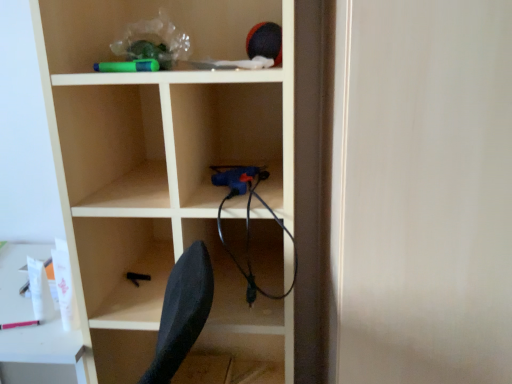
This screenshot has width=512, height=384. I want to click on white glossy table at lower left, so (x=42, y=354).

Describe the element at coordinates (42, 354) in the screenshot. The height and width of the screenshot is (384, 512). I see `white glossy table at lower left` at that location.

The image size is (512, 384). What are the coordinates of `wooden shelf at center` in the screenshot? It's located at (162, 168).

What is the approximate width of wooden shelf at center?

41.11 centimeters.

Describe the element at coordinates (162, 168) in the screenshot. Image resolution: width=512 pixels, height=384 pixels. I see `wooden shelf at center` at that location.

The width and height of the screenshot is (512, 384). In order to click on white glossy table at lower left in this screenshot , I will do `click(42, 354)`.

Which object is positioned more to the right, wooden shelf at center or white glossy table at lower left?

Positioned to the right is wooden shelf at center.

Which object is further away from the camera, wooden shelf at center or white glossy table at lower left?

Positioned behind is white glossy table at lower left.

Considering the positions of points (216, 142) and (58, 361), is point (216, 142) farther from camera compared to point (58, 361)?

Yes, point (216, 142) is farther from viewer.

From the image's perspective, is wooden shelf at center on top of white glossy table at lower left?

Yes, from the image's perspective, wooden shelf at center is over white glossy table at lower left.

From a real-world perspective, which object stands above the other?

From a 3D spatial view, wooden shelf at center is above.

Considering the sizes of objects wooden shelf at center and white glossy table at lower left in the image provided, who is thinner, wooden shelf at center or white glossy table at lower left?

wooden shelf at center is thinner.

Is wooden shelf at center taller or shorter than white glossy table at lower left?

wooden shelf at center is taller than white glossy table at lower left.

Based on the photo, considering the relative sizes of wooden shelf at center and white glossy table at lower left in the image provided, is wooden shelf at center smaller than white glossy table at lower left?

Actually, wooden shelf at center might be larger than white glossy table at lower left.

Is white glossy table at lower left a part of wooden shelf at center?

Actually, white glossy table at lower left is outside wooden shelf at center.

Is wooden shelf at center not close to white glossy table at lower left?

wooden shelf at center is near white glossy table at lower left, not far away.

Is wooden shelf at center positioned with its back to white glossy table at lower left?

No.

Can you tell me how much wooden shelf at center and white glossy table at lower left differ in facing direction?

The angle between the facing direction of wooden shelf at center and the facing direction of white glossy table at lower left is 0.671 degrees.

How much distance is there between wooden shelf at center and white glossy table at lower left?

wooden shelf at center and white glossy table at lower left are 15.18 inches apart.

Locate an element on the screen. The image size is (512, 384). table below the wooden shelf at center (from the image's perspective) is located at coordinates click(42, 354).

Considering the positions of objects white glossy table at lower left and wooden shelf at center in the image provided, who is more to the left, white glossy table at lower left or wooden shelf at center?

white glossy table at lower left.

Is white glossy table at lower left closer to camera compared to wooden shelf at center?

No.

Is point (34, 330) behind point (137, 257)?

No, it is in front of (137, 257).

From the image's perspective, between white glossy table at lower left and wooden shelf at center, who is located below?

white glossy table at lower left, from the image's perspective.

From a real-world perspective, between white glossy table at lower left and wooden shelf at center, who is vertically higher?

wooden shelf at center, from a real-world perspective.

Is white glossy table at lower left wider than wooden shelf at center?

Indeed, white glossy table at lower left has a greater width compared to wooden shelf at center.

Considering the relative sizes of white glossy table at lower left and wooden shelf at center in the image provided, is white glossy table at lower left shorter than wooden shelf at center?

Yes.

Considering the sizes of objects white glossy table at lower left and wooden shelf at center in the image provided, who is bigger, white glossy table at lower left or wooden shelf at center?

With larger size is wooden shelf at center.

Is white glossy table at lower left positioned beyond the bounds of wooden shelf at center?

Indeed, white glossy table at lower left is completely outside wooden shelf at center.

Is white glossy table at lower left beside wooden shelf at center?

No, white glossy table at lower left is not next to wooden shelf at center.

Is white glossy table at lower left aimed at wooden shelf at center?

No, white glossy table at lower left is not facing towards wooden shelf at center.

How much distance is there between white glossy table at lower left and wooden shelf at center?

white glossy table at lower left and wooden shelf at center are 15.18 inches apart from each other.

Where is `shelf that is on the right side of white glossy table at lower left`? This screenshot has width=512, height=384. shelf that is on the right side of white glossy table at lower left is located at coordinates (162, 168).

At what (x,y) coordinates should I click in order to perform the action: click on table located underneath the wooden shelf at center (from a real-world perspective). Please return your answer as a coordinate pair (x, y). Looking at the image, I should click on (42, 354).

At what (x,y) coordinates should I click in order to perform the action: click on table on the left of wooden shelf at center. Please return your answer as a coordinate pair (x, y). This screenshot has width=512, height=384. Looking at the image, I should click on (42, 354).